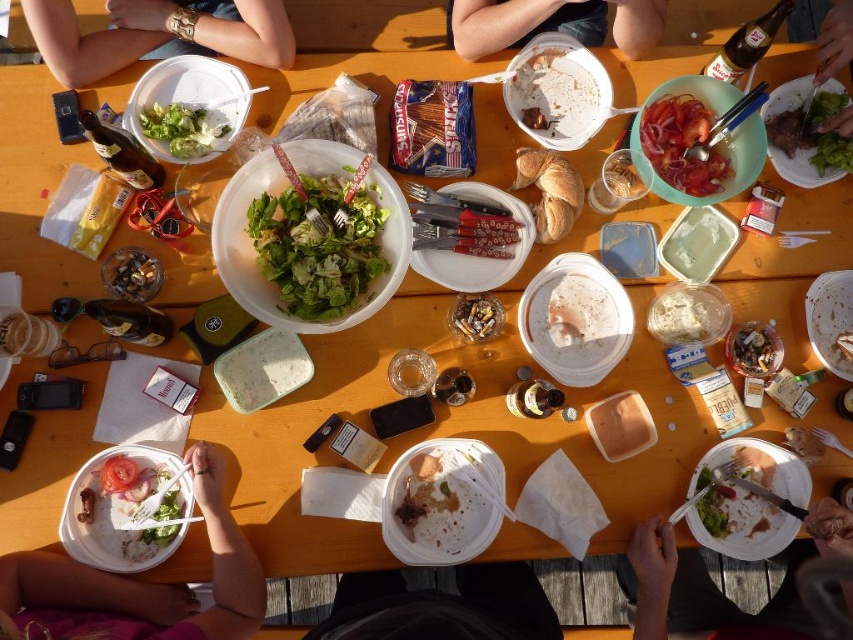
Question: Does green leafy salad at upper left appear on the right side of shiny metallic ashtray at center?

Choices:
 (A) yes
 (B) no

Answer: (B)

Question: Is white paper plate at lower right wider than green leafy salad at upper left?

Choices:
 (A) no
 (B) yes

Answer: (B)

Question: Which object is closer to the camera taking this photo?

Choices:
 (A) white plastic fork at lower left
 (B) white creamy substance at center
 (C) shiny metallic ashtray at center
 (D) matte plastic container at center

Answer: (A)

Question: Can you confirm if white paper plate at lower right is wider than green leafy salad at upper left?

Choices:
 (A) yes
 (B) no

Answer: (A)

Question: Considering the real-world distances, which object is closest to the white matte bread at center?

Choices:
 (A) white plastic fork at lower left
 (B) shiny metallic coins at upper left
 (C) white paper plate at lower right
 (D) smooth white bowl at upper center

Answer: (C)

Question: Which of the following is the farthest from the observer?

Choices:
 (A) tomato slices at center
 (B) white plastic fork at lower left
 (C) green leafy salad at upper left
 (D) green leafy salad at upper center

Answer: (D)